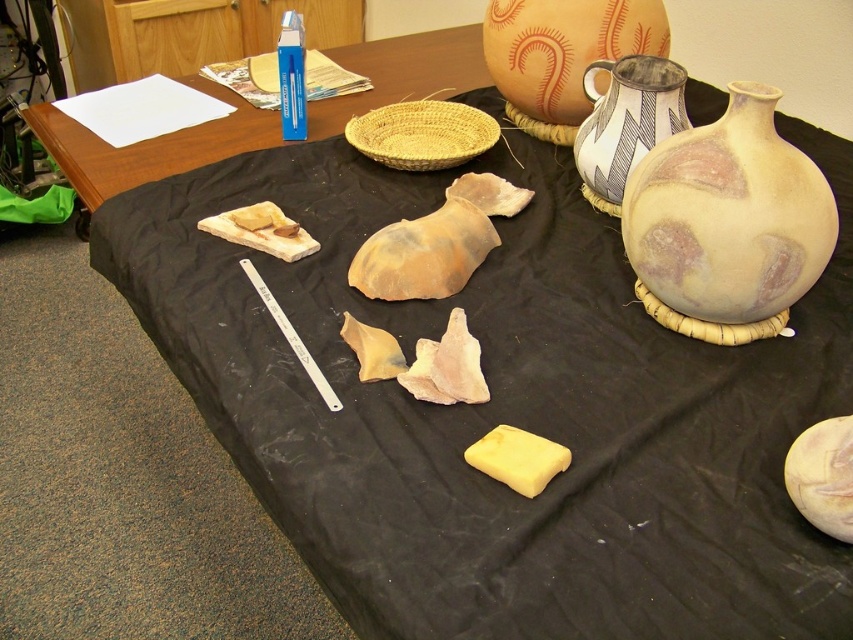
Looking at this image, you are a researcher organizing items on a table covered with a black cloth. You need to place a basket at the point marked by the coordinates point (149, 145). However, there is already an object at that location. Which object is blocking the basket placement?

The point (149, 145) marks the wooden table at upper left, so placing the basket there would require removing the existing wooden table at upper left first.

You are standing at the edge of the wooden table at upper left and want to reach a pottery fragment that is 2 feet away from the edge. Can you safely extend your hand to pick it up without overreaching?

The distance between you and the wooden table at upper left is 3.54 feet. Since the pottery fragment is only 2 feet away from the edge, you can safely reach it without overextending your arm.